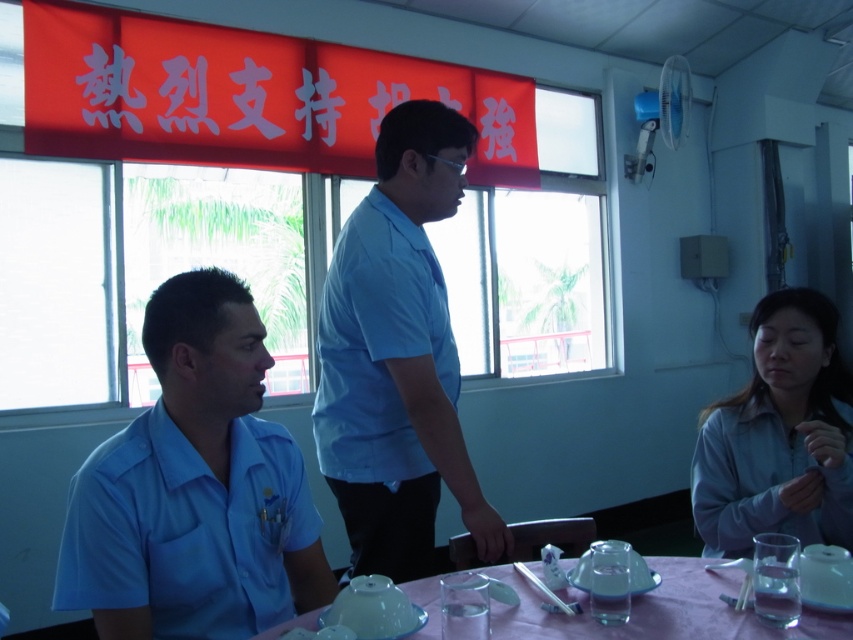
You are a photographer trying to capture a group photo of the matte blue shirt at left and the light blue fabric shirt at lower right. Since you want to ensure both are clearly visible in the photo, which one should you focus on first to make sure they are in sharp focus?

The matte blue shirt at left is in front of the light blue fabric shirt at lower right, so you should focus on the matte blue shirt at left first to ensure it is in sharp focus before the background person.

You are organizing a photo shoot in the meeting room. The photographer wants to ensure that the light blue shirt at center and the pink plastic table at lower center are both visible in the frame. Considering their sizes, which object should be placed closer to the camera to maintain their visibility?

The light blue shirt at center is larger than the pink plastic table at lower center, so to maintain visibility, the pink plastic table at lower center should be placed closer to the camera since it is smaller and needs to be more prominent in the frame.